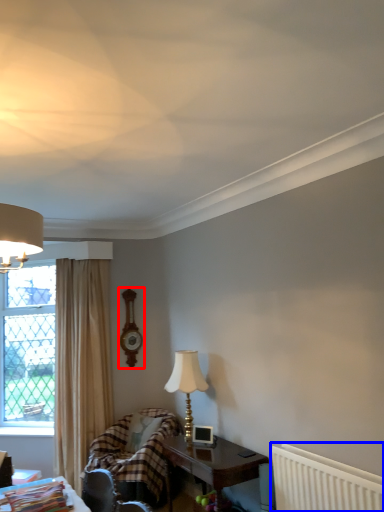
Question: Which point is further to the camera, clock (highlighted by a red box) or radiator (highlighted by a blue box)?

Choices:
 (A) clock
 (B) radiator

Answer: (A)